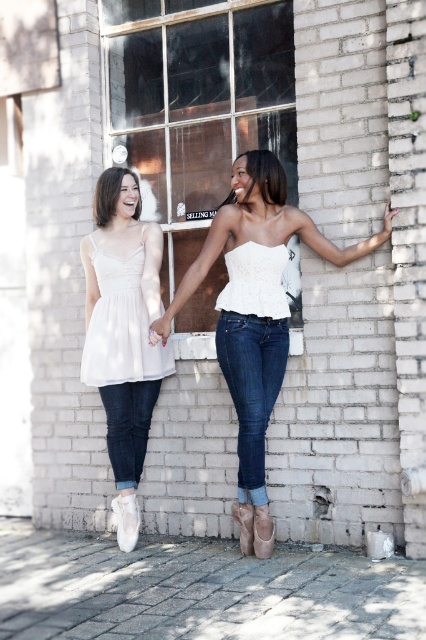
You are a photographer setting up for a photoshoot and need to arrange two models wearing the white lace top at center and the white satin dress at left. According to the scene description, which model should stand to the left to match the original image?

The white satin dress at left should stand to the left because the white lace top at center is positioned on the right side of it in the original image.

You are standing in front of the white brick wall with two points marked. You want to place a small plant pot exactly halfway between point [235,208] and point [134,404]. Will the pot be closer to the wall or further away from it compared to the original points?

The pot placed halfway between point [235,208] and point [134,404] will be closer to the wall than point [134,404] but farther than point [235,208]. Since point [235,208] is closer to the viewer, the midpoint would be somewhere between their distances. However, without exact depth measurements, we can only state relative positions based on the given information.

You are standing in the scene and want to move from the point at coordinates point (x=273, y=378) to the point at coordinates point (x=140, y=310). Which direction should you move to get closer to your destination?

To move from point (x=273, y=378) to point (x=140, y=310), you should move diagonally towards the upper left direction since point (x=140, y=310) is located above and to the left of point (x=273, y=378).